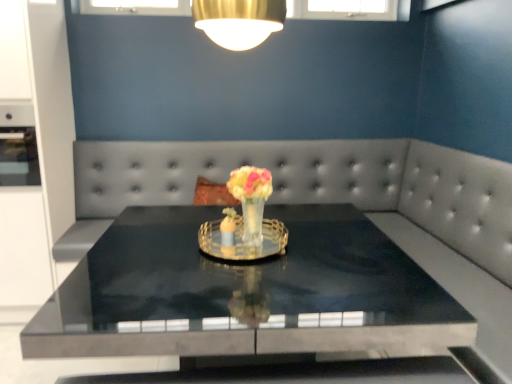
Question: Should I look upward or downward to see satin gray couch at center?

Choices:
 (A) up
 (B) down

Answer: (B)

Question: Is satin gray couch at center at the left side of black polished table at center?

Choices:
 (A) no
 (B) yes

Answer: (B)

Question: Is satin gray couch at center wider than black polished table at center?

Choices:
 (A) no
 (B) yes

Answer: (A)

Question: From the image's perspective, would you say satin gray couch at center is positioned over black polished table at center?

Choices:
 (A) no
 (B) yes

Answer: (B)

Question: Does satin gray couch at center have a greater height compared to black polished table at center?

Choices:
 (A) yes
 (B) no

Answer: (A)

Question: Can you confirm if satin gray couch at center is bigger than black polished table at center?

Choices:
 (A) no
 (B) yes

Answer: (A)

Question: Does satin gray couch at center have a lesser height compared to black polished table at center?

Choices:
 (A) no
 (B) yes

Answer: (A)

Question: Considering the relative sizes of satin gray couch at center and translucent glass vase at center in the image provided, is satin gray couch at center wider than translucent glass vase at center?

Choices:
 (A) no
 (B) yes

Answer: (B)

Question: Considering the relative positions of satin gray couch at center and translucent glass vase at center in the image provided, is satin gray couch at center to the left of translucent glass vase at center from the viewer's perspective?

Choices:
 (A) no
 (B) yes

Answer: (B)

Question: From the image's perspective, is satin gray couch at center beneath translucent glass vase at center?

Choices:
 (A) yes
 (B) no

Answer: (A)

Question: Considering the relative sizes of satin gray couch at center and translucent glass vase at center in the image provided, is satin gray couch at center shorter than translucent glass vase at center?

Choices:
 (A) yes
 (B) no

Answer: (B)

Question: From a real-world perspective, does satin gray couch at center sit lower than translucent glass vase at center?

Choices:
 (A) no
 (B) yes

Answer: (B)

Question: Is satin gray couch at center smaller than translucent glass vase at center?

Choices:
 (A) yes
 (B) no

Answer: (B)

Question: Considering the relative sizes of translucent glass vase at center and satin gray couch at center in the image provided, is translucent glass vase at center bigger than satin gray couch at center?

Choices:
 (A) no
 (B) yes

Answer: (A)